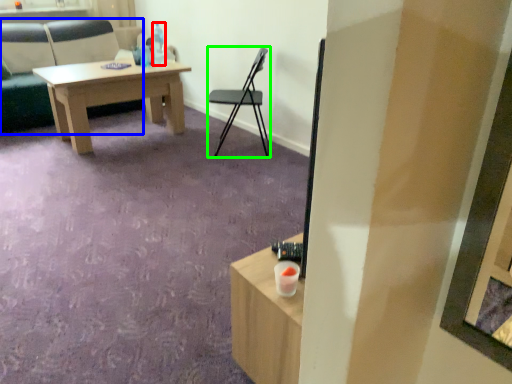
Question: Considering the real-world distances, which object is farthest from bottle (highlighted by a red box)? chair (highlighted by a blue box) or chair (highlighted by a green box)?

Choices:
 (A) chair
 (B) chair

Answer: (A)